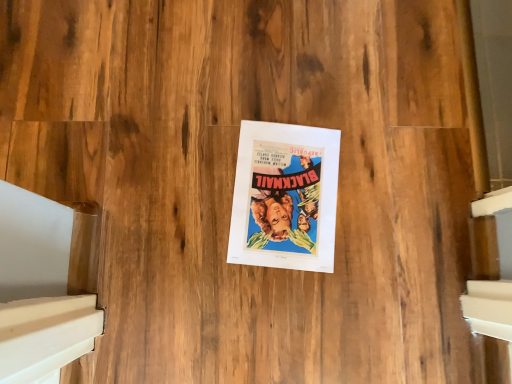
Find the location of a particular element. This screenshot has width=512, height=384. vacant location below matte paper poster at center (from a real-world perspective) is located at coordinates (280, 195).